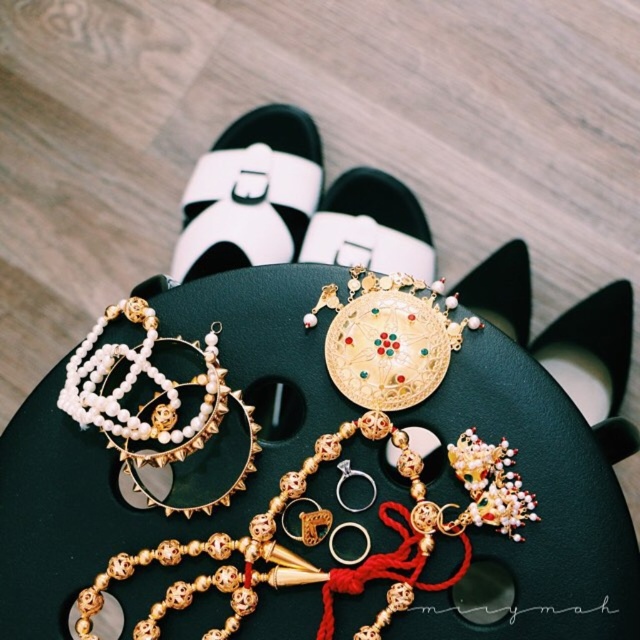
Question: Which point appears closest to the camera in this image?

Choices:
 (A) (145, 420)
 (B) (502, 280)

Answer: (A)

Question: Among these points, which one is farthest from the camera?

Choices:
 (A) (147, 474)
 (B) (611, 422)

Answer: (A)

Question: Can you confirm if black matte shoe at center is wider than gold textured brooch at upper center?

Choices:
 (A) no
 (B) yes

Answer: (B)

Question: Which point is farther from the camera taking this photo?

Choices:
 (A) pyautogui.click(x=385, y=202)
 (B) pyautogui.click(x=292, y=563)
 (C) pyautogui.click(x=230, y=129)
 (D) pyautogui.click(x=582, y=304)

Answer: (C)

Question: Does gold metallic earring at center have a smaller size compared to gold textured brooch at upper center?

Choices:
 (A) yes
 (B) no

Answer: (B)

Question: Does white leather sandal at upper center have a larger size compared to gold metallic earring at center?

Choices:
 (A) no
 (B) yes

Answer: (B)